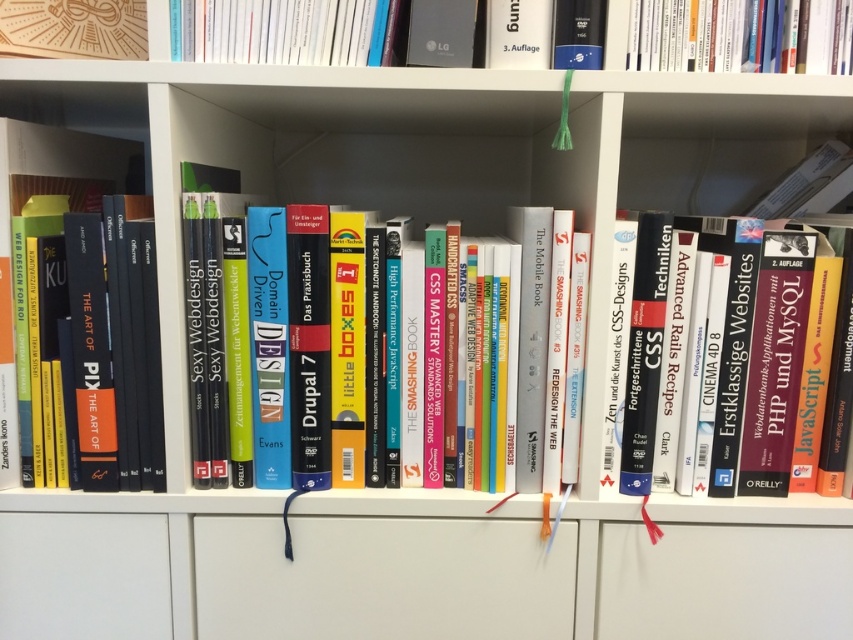
At what (x,y) coordinates should I click in order to perform the action: click on hardcover book at upper center. Please return your answer as a coordinate pair (x, y). Looking at the image, I should click on (740, 35).

Measure the distance between point (718,17) and camera.

Point (718,17) is 74.04 centimeters away from camera.

Describe the element at coordinates (740, 35) in the screenshot. I see `hardcover book at upper center` at that location.

Locate an element on the screen. hardcover book at upper center is located at coordinates (740, 35).

Consider the image. Between hardcover books at center and matte black book at left, which one appears on the right side from the viewer's perspective?

From the viewer's perspective, hardcover books at center appears more on the right side.

Who is positioned more to the left, hardcover books at center or matte black book at left?

matte black book at left

Who is more forward, [347,352] or [96,134]?

Positioned in front is point [347,352].

This screenshot has height=640, width=853. Identify the location of hardcover books at center. (346, 401).

Which is behind, point (354, 248) or point (761, 292)?

Point (761, 292)

Is point (281, 406) positioned after point (730, 465)?

No, it is in front of (730, 465).

Is point (439, 408) in front of point (805, 307)?

No, it is not.

In order to click on hardcover books at center in this screenshot , I will do `click(346, 401)`.